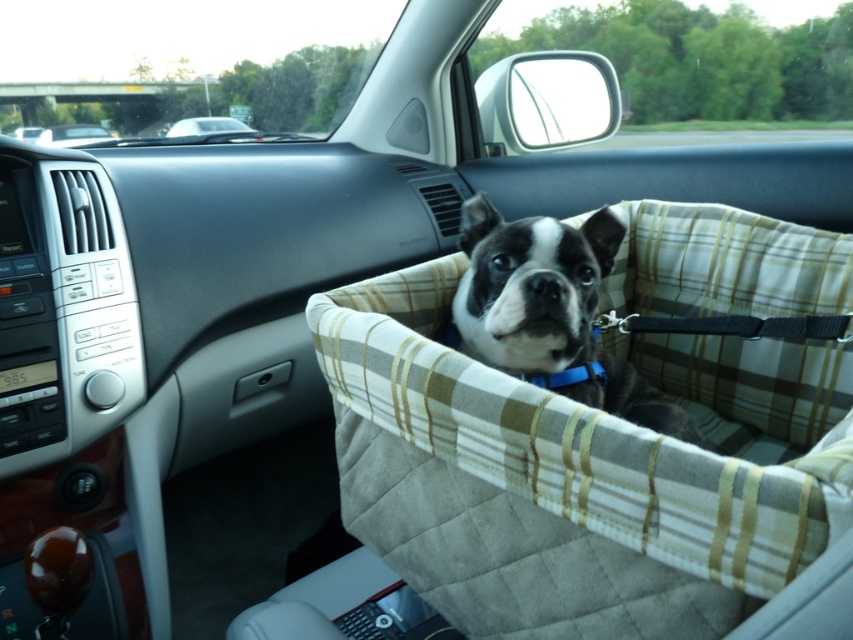
Between black-and-white fur dog at center and matte black car at upper left, which one appears on the left side from the viewer's perspective?

matte black car at upper left is more to the left.

Is black-and-white fur dog at center shorter than matte black car at upper left?

No, black-and-white fur dog at center is not shorter than matte black car at upper left.

Does point (592, 342) come in front of point (84, 131)?

That is True.

I want to click on black-and-white fur dog at center, so click(x=550, y=312).

Does plaid fabric dog bed at center have a greater height compared to black-and-white fur dog at center?

Correct, plaid fabric dog bed at center is much taller as black-and-white fur dog at center.

Is point (341, 289) positioned behind point (482, 260)?

Yes.

Where is `plaid fabric dog bed at center`? The width and height of the screenshot is (853, 640). plaid fabric dog bed at center is located at coordinates (577, 472).

Does plaid fabric dog bed at center have a smaller size compared to white plastic car at upper center?

Incorrect, plaid fabric dog bed at center is not smaller in size than white plastic car at upper center.

Is plaid fabric dog bed at center positioned before white plastic car at upper center?

Yes, it is.

Where is `plaid fabric dog bed at center`? plaid fabric dog bed at center is located at coordinates (577, 472).